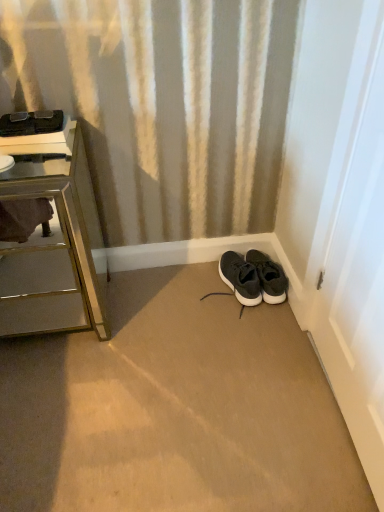
Where is `free spot to the right of metallic mirrored chest of drawers at left`? Image resolution: width=384 pixels, height=512 pixels. free spot to the right of metallic mirrored chest of drawers at left is located at coordinates (154, 322).